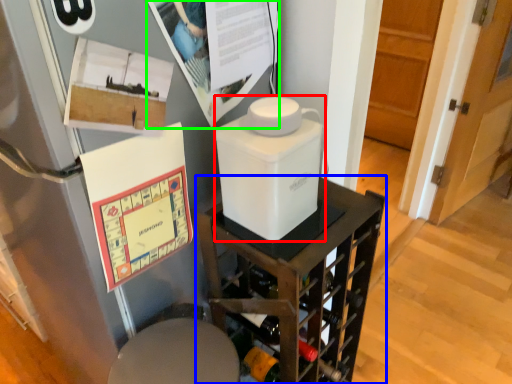
Question: Which object is positioned closest to appliance (highlighted by a red box)? Select from furniture (highlighted by a blue box) and poster page (highlighted by a green box).

Choices:
 (A) furniture
 (B) poster page

Answer: (B)